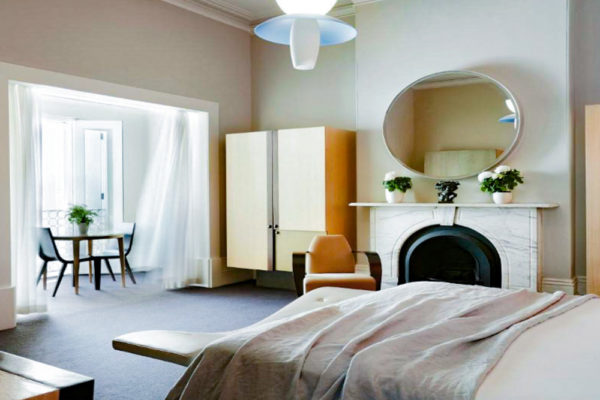
Where is `chair`? The height and width of the screenshot is (400, 600). chair is located at coordinates (322, 258).